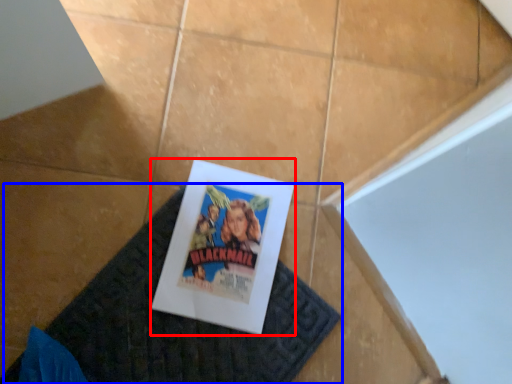
Question: Which object is closer to the camera taking this photo, poster (highlighted by a red box) or doormat (highlighted by a blue box)?

Choices:
 (A) poster
 (B) doormat

Answer: (B)